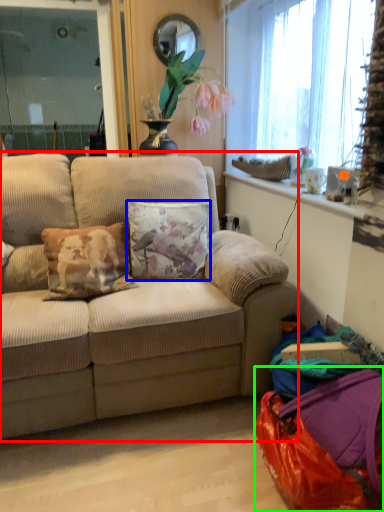
Question: Based on their relative distances, which object is farther from studio couch (highlighted by a red box)? Choose from pillow (highlighted by a blue box) and bag (highlighted by a green box).

Choices:
 (A) pillow
 (B) bag

Answer: (B)